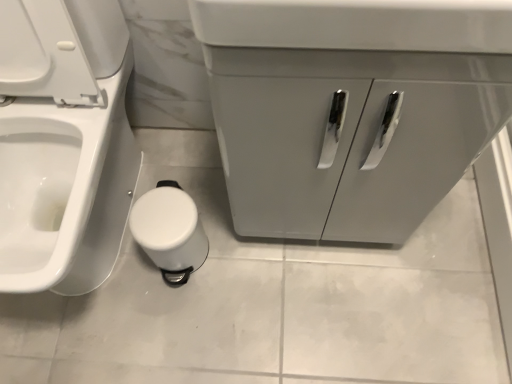
Where is `free space in front of white plastic toilet paper at lower center`? free space in front of white plastic toilet paper at lower center is located at coordinates (175, 318).